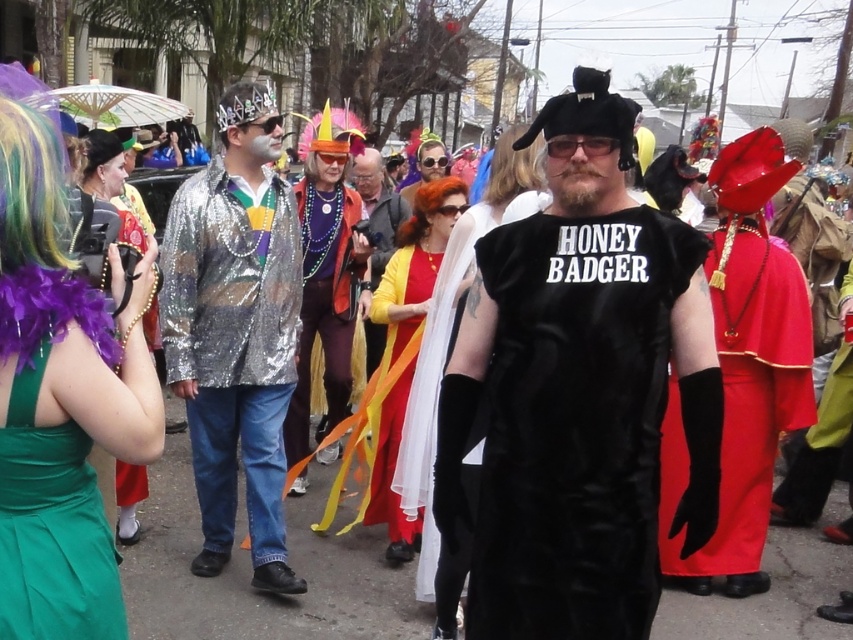
Between point (368, 173) and point (102, 144), which one is positioned behind?

Positioned behind is point (368, 173).

Does orange fabric at center come behind dark brown curly wig at upper left?

Yes, orange fabric at center is further from the viewer.

Between point (363, 164) and point (86, 134), which one is positioned in front?

Point (86, 134)

This screenshot has width=853, height=640. What are the coordinates of `orange fabric at center` in the screenshot? It's located at (376, 216).

Consider the image. Is green satin dress at lower left taller than dark brown curly wig at upper left?

Correct, green satin dress at lower left is much taller as dark brown curly wig at upper left.

Does green satin dress at lower left appear on the left side of dark brown curly wig at upper left?

Incorrect, green satin dress at lower left is not on the left side of dark brown curly wig at upper left.

Between point (36, 360) and point (83, 170), which one is positioned behind?

Positioned behind is point (83, 170).

Find the location of a particular element. The width and height of the screenshot is (853, 640). green satin dress at lower left is located at coordinates click(51, 528).

From the picture: Can you confirm if green satin dress at lower left is positioned to the right of shiny silver wig at upper center?

Yes, green satin dress at lower left is to the right of shiny silver wig at upper center.

How distant is green satin dress at lower left from shiny silver wig at upper center?

The distance of green satin dress at lower left from shiny silver wig at upper center is 2.53 meters.

The height and width of the screenshot is (640, 853). Identify the location of green satin dress at lower left. (51, 528).

The image size is (853, 640). What are the coordinates of `green satin dress at lower left` in the screenshot? It's located at [51, 528].